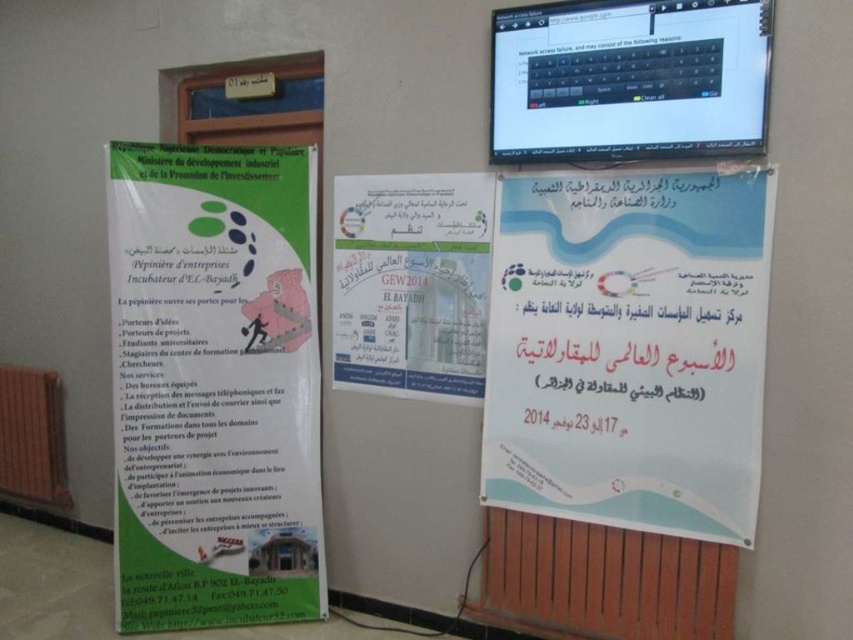
Looking at this image, you are organizing a presentation and need to place both the white paper poster at center and the white paper at center on a bulletin board. Which one should you choose if you want the wider option for more content?

The white paper poster at center is wider than the white paper at center, so you should choose the white paper poster at center for more content.

You are an office assistant who needs to hang a new 12 inch wide framed photo between the white paper poster at center and the white paper at center on the wall display. Can you fit it without overlapping either item?

The distance between the white paper poster at center and the white paper at center is 16.62 inches. Since the framed photo is 12 inches wide, there is enough space to fit it between them without overlapping either item.

What are the coordinates of the matte green poster at left?

The matte green poster at left is located at coordinates point (213, 385).